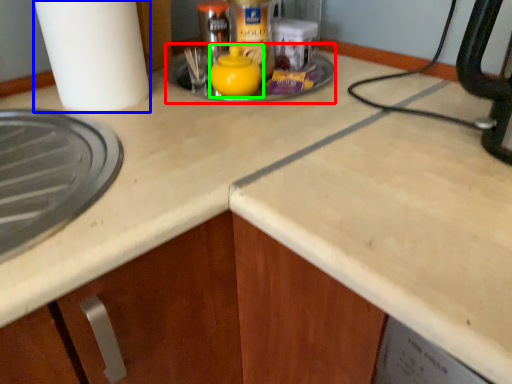
Question: Estimate the real-world distances between objects in this image. Which object is closer to sink (highlighted by a red box), paper towel (highlighted by a blue box) or tea pot (highlighted by a green box)?

Choices:
 (A) paper towel
 (B) tea pot

Answer: (B)